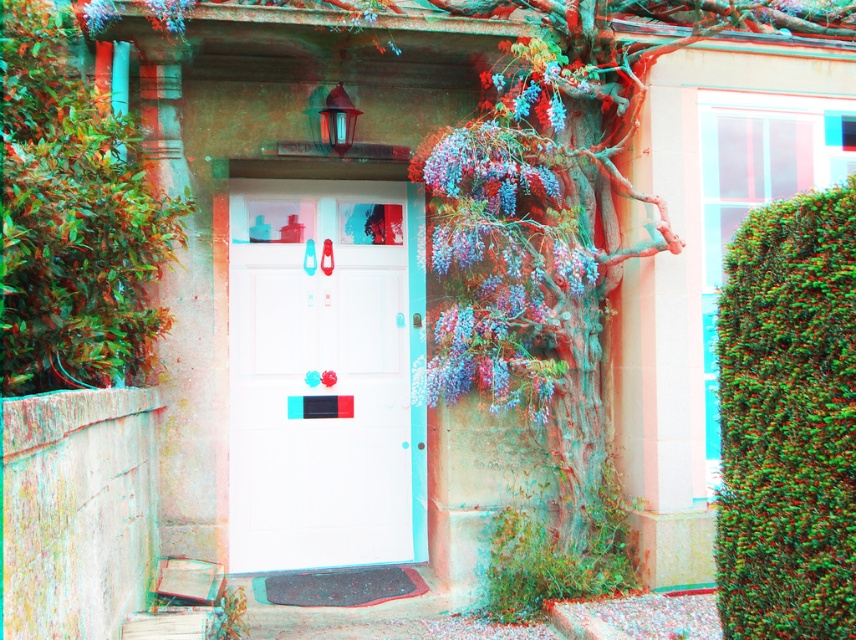
You are a painter who needs to paint both the white glossy door at center and the green textured hedge at right. Based on their sizes, which object will require more paint?

The white glossy door at center requires more paint because it has a larger size compared to the green textured hedge at right.